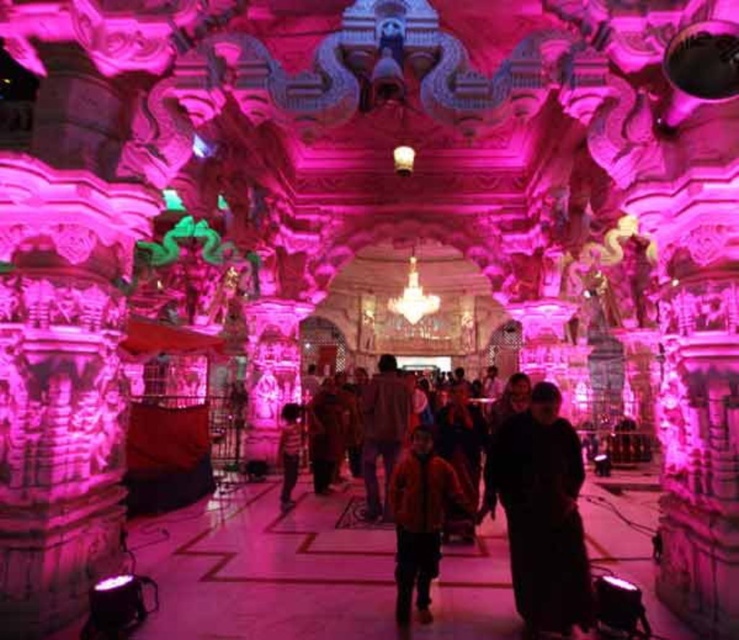
You are a visitor in the temple and want to place a small offering on the brown fabric cloth at center. However, there is a striped shirt at center in the way. Can you place the offering directly on the cloth without moving the shirt?

The brown fabric cloth at center is not as tall as striped shirt at center, so the striped shirt at center is taller. This means the shirt is blocking the cloth, making it difficult to place the offering directly on the cloth without moving the shirt.

You are a visitor in the temple and want to take a photo of both the brown fabric cloth at center and the striped shirt at center. Which object should you focus on first if you want to capture both in a single frame without moving the camera?

You should focus on the brown fabric cloth at center first because it is smaller than the striped shirt at center, allowing you to frame both objects effectively in the shot.

From the picture: You are a photographer standing at the camera position in the temple. You want to take a photo of the black matte dress at center. Can you move closer to the dress to ensure it fills the frame without distortion? The minimum focusing distance for your camera is 2 meters.

The black matte dress at center and camera are 5.79 meters apart from each other. Since the minimum focusing distance is 2 meters, you can move closer to the dress to ensure it fills the frame without distortion as long as you stay at least 2 meters away from it.